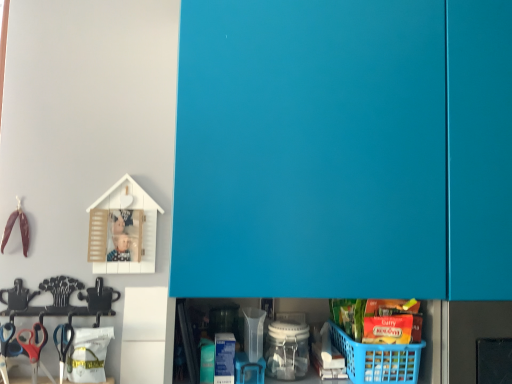
Question: Is pink plastic scissors at lower left closer to the viewer compared to teal matte cabinet doors at upper center?

Choices:
 (A) yes
 (B) no

Answer: (B)

Question: Can you confirm if pink plastic scissors at lower left is positioned to the right of teal matte cabinet doors at upper center?

Choices:
 (A) no
 (B) yes

Answer: (A)

Question: Could you tell me if pink plastic scissors at lower left is facing teal matte cabinet doors at upper center?

Choices:
 (A) no
 (B) yes

Answer: (A)

Question: Can you confirm if pink plastic scissors at lower left is shorter than teal matte cabinet doors at upper center?

Choices:
 (A) yes
 (B) no

Answer: (A)

Question: Is pink plastic scissors at lower left not inside teal matte cabinet doors at upper center?

Choices:
 (A) no
 (B) yes

Answer: (B)

Question: Looking at their shapes, would you say pink plastic scissors at lower left is wider or thinner than blue plastic basket at lower right?

Choices:
 (A) wide
 (B) thin

Answer: (B)

Question: From the image's perspective, relative to blue plastic basket at lower right, is pink plastic scissors at lower left above or below?

Choices:
 (A) below
 (B) above

Answer: (A)

Question: In the image, is pink plastic scissors at lower left positioned in front of or behind blue plastic basket at lower right?

Choices:
 (A) behind
 (B) front

Answer: (A)

Question: Considering the positions of point (41, 345) and point (403, 349), is point (41, 345) closer or farther from the camera than point (403, 349)?

Choices:
 (A) closer
 (B) farther

Answer: (B)

Question: Do you think teal matte cabinet doors at upper center is within pink plastic scissors at lower left, or outside of it?

Choices:
 (A) inside
 (B) outside

Answer: (B)

Question: In the image, is teal matte cabinet doors at upper center positioned in front of or behind pink plastic scissors at lower left?

Choices:
 (A) front
 (B) behind

Answer: (A)

Question: From a real-world perspective, is teal matte cabinet doors at upper center above or below pink plastic scissors at lower left?

Choices:
 (A) above
 (B) below

Answer: (A)

Question: Is teal matte cabinet doors at upper center to the left or to the right of pink plastic scissors at lower left in the image?

Choices:
 (A) right
 (B) left

Answer: (A)

Question: In the image, is blue plastic basket at lower right positioned in front of or behind teal matte cabinet doors at upper center?

Choices:
 (A) behind
 (B) front

Answer: (A)

Question: Choose the correct answer: Is blue plastic basket at lower right inside teal matte cabinet doors at upper center or outside it?

Choices:
 (A) inside
 (B) outside

Answer: (A)